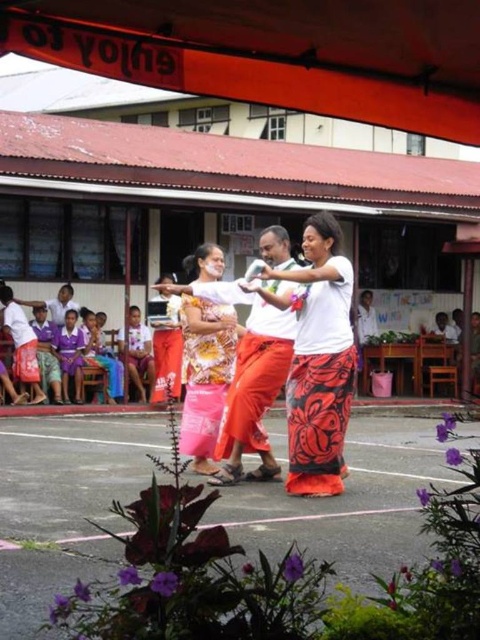
Question: Which of the following is the farthest from the observer?

Choices:
 (A) floral fabric skirt at center
 (B) patterned fabric dress at center
 (C) floral woven skirt at center

Answer: (B)

Question: In this image, where is floral woven skirt at center located relative to floral fabric skirt at center?

Choices:
 (A) right
 (B) left

Answer: (A)

Question: Which point is closer to the camera?

Choices:
 (A) (230, 353)
 (B) (316, 465)

Answer: (B)

Question: Can you confirm if floral woven skirt at center is wider than floral fabric skirt at center?

Choices:
 (A) yes
 (B) no

Answer: (B)

Question: Can you confirm if floral woven skirt at center is positioned to the right of floral fabric skirt at center?

Choices:
 (A) yes
 (B) no

Answer: (A)

Question: Which point is farther from the camera taking this photo?

Choices:
 (A) 196,342
 (B) 251,333
 (C) 290,412

Answer: (A)